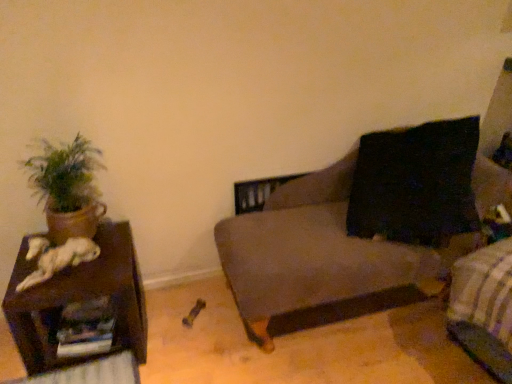
Question: Does dark brown fabric bed frame at lower right appear on the right side of green matte plant at left?

Choices:
 (A) no
 (B) yes

Answer: (B)

Question: Is dark brown fabric bed frame at lower right thinner than green matte plant at left?

Choices:
 (A) no
 (B) yes

Answer: (A)

Question: Are dark brown fabric bed frame at lower right and green matte plant at left located far from each other?

Choices:
 (A) yes
 (B) no

Answer: (A)

Question: From the image's perspective, is dark brown fabric bed frame at lower right above green matte plant at left?

Choices:
 (A) no
 (B) yes

Answer: (A)

Question: Is dark brown fabric bed frame at lower right at the left side of green matte plant at left?

Choices:
 (A) yes
 (B) no

Answer: (B)

Question: Would you say dark brown fabric bed frame at lower right is outside green matte plant at left?

Choices:
 (A) no
 (B) yes

Answer: (B)

Question: Can you confirm if brown wooden side table at left is smaller than dark gray fabric couch at center?

Choices:
 (A) no
 (B) yes

Answer: (B)

Question: Is dark gray fabric couch at center inside brown wooden side table at left?

Choices:
 (A) yes
 (B) no

Answer: (B)

Question: Is brown wooden side table at left positioned before dark gray fabric couch at center?

Choices:
 (A) no
 (B) yes

Answer: (A)

Question: Can you confirm if brown wooden side table at left is shorter than dark gray fabric couch at center?

Choices:
 (A) yes
 (B) no

Answer: (A)

Question: Is brown wooden side table at left facing away from dark gray fabric couch at center?

Choices:
 (A) no
 (B) yes

Answer: (A)

Question: Is brown wooden side table at left to the left of dark gray fabric couch at center from the viewer's perspective?

Choices:
 (A) yes
 (B) no

Answer: (A)

Question: Is green matte plant at left closer to the viewer compared to brown wooden side table at left?

Choices:
 (A) no
 (B) yes

Answer: (A)